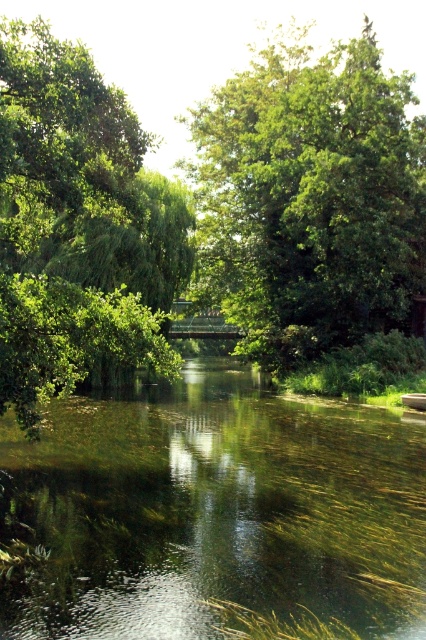
The height and width of the screenshot is (640, 426). What do you see at coordinates (219, 509) in the screenshot?
I see `green grassy lake at center` at bounding box center [219, 509].

Which is more to the right, green grassy lake at center or green leafy tree at left?

Positioned to the right is green grassy lake at center.

What do you see at coordinates (219, 509) in the screenshot? The image size is (426, 640). I see `green grassy lake at center` at bounding box center [219, 509].

Where is `green grassy lake at center`? This screenshot has width=426, height=640. green grassy lake at center is located at coordinates (219, 509).

Which is more to the right, green grassy lake at center or green leafy tree at center?

From the viewer's perspective, green leafy tree at center appears more on the right side.

Is green grassy lake at center above green leafy tree at center?

Actually, green grassy lake at center is below green leafy tree at center.

In order to click on green grassy lake at center in this screenshot , I will do `click(219, 509)`.

I want to click on green grassy lake at center, so click(x=219, y=509).

Does green leafy tree at center appear over green leafy tree at left?

Yes.

In order to click on green leafy tree at center in this screenshot , I will do `click(310, 198)`.

Is point (253, 166) positioned behind point (78, 353)?

Yes, it is behind point (78, 353).

Where is `green leafy tree at center`? This screenshot has width=426, height=640. green leafy tree at center is located at coordinates (310, 198).